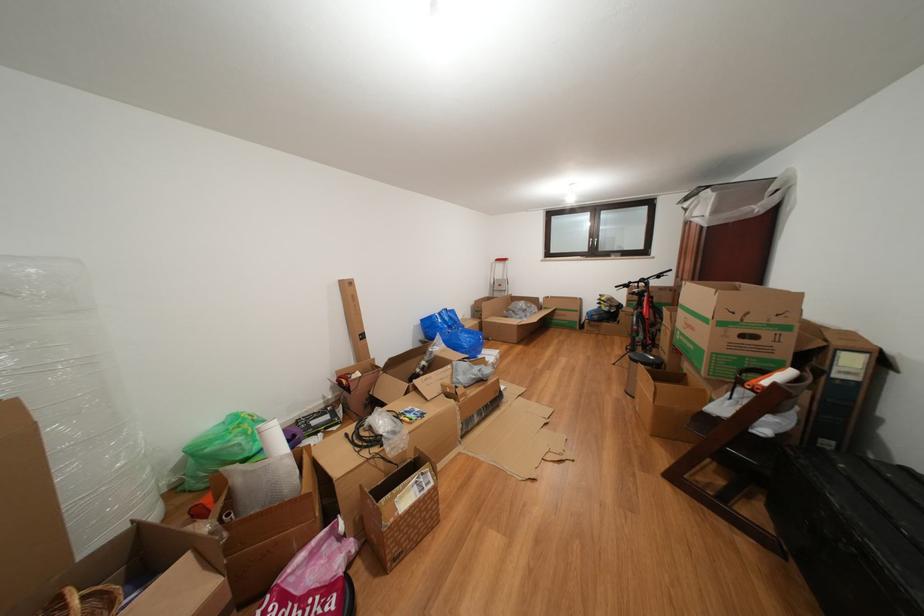
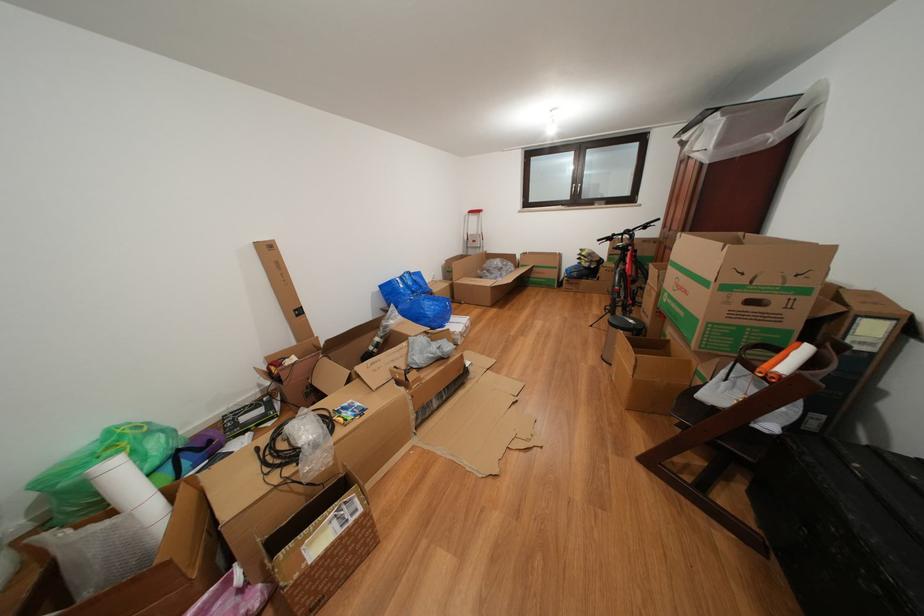
The point at (761, 437) is marked in the first image. Where is the corresponding point in the second image?

(763, 431)